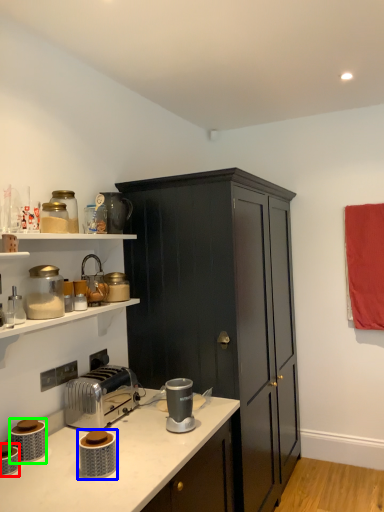
Question: Which object is the closest to the appliance (highlighted by a red box)? Choose among these: appliance (highlighted by a blue box) or appliance (highlighted by a green box).

Choices:
 (A) appliance
 (B) appliance

Answer: (B)